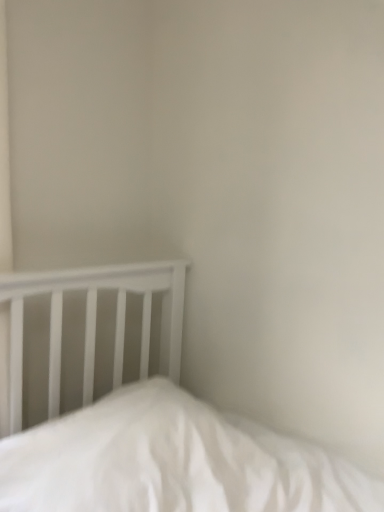
Locate an element on the screen. white matte bed at center is located at coordinates (149, 422).

What do you see at coordinates (149, 422) in the screenshot? I see `white matte bed at center` at bounding box center [149, 422].

Locate an element on the screen. The height and width of the screenshot is (512, 384). white matte bed at center is located at coordinates (149, 422).